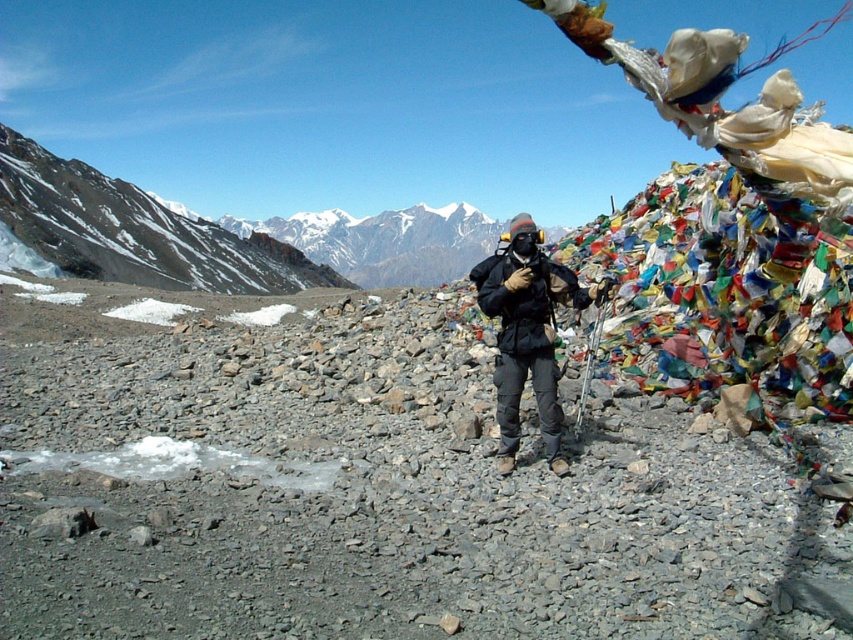
Question: Among these objects, which one is farthest from the camera?

Choices:
 (A) black matte jacket at center
 (B) gray gravel at center

Answer: (A)

Question: Which point is farther to the camera?

Choices:
 (A) (363, 333)
 (B) (485, 314)

Answer: (A)

Question: Is the position of gray gravel at center less distant than that of black matte jacket at center?

Choices:
 (A) no
 (B) yes

Answer: (B)

Question: Among these objects, which one is nearest to the camera?

Choices:
 (A) black matte jacket at center
 (B) gray gravel at center

Answer: (B)

Question: Can you confirm if gray gravel at center is bigger than black matte jacket at center?

Choices:
 (A) no
 (B) yes

Answer: (B)

Question: Does gray gravel at center appear on the left side of black matte jacket at center?

Choices:
 (A) yes
 (B) no

Answer: (A)